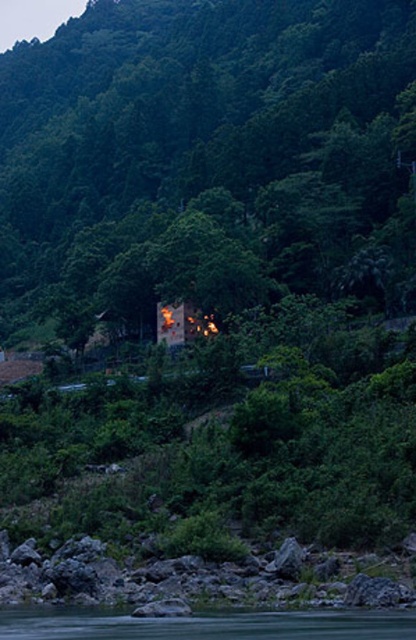
Is green leafy tree at center further to the viewer compared to green smooth water at lower center?

Yes, green leafy tree at center is further from the viewer.

Does point (348, 189) lie behind point (364, 625)?

Yes, point (348, 189) is behind point (364, 625).

You are a GUI agent. You are given a task and a screenshot of the screen. Output one action in this format:
    pyautogui.click(x=<x>, y=<y>)
    Task: Click on the green leafy tree at center
    
    Given the screenshot: What is the action you would take?
    pyautogui.click(x=208, y=161)